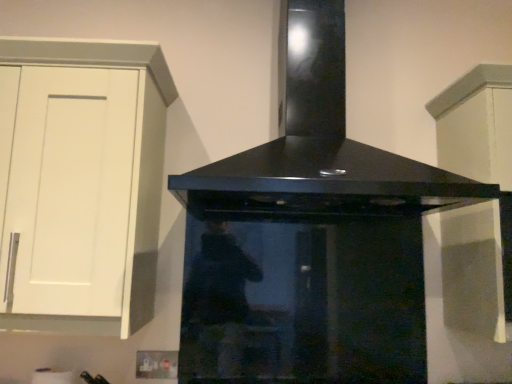
Question: From the image's perspective, is black glossy range hood at center below white matte cabinet at upper right, the 1th cabinetry viewed from the right?

Choices:
 (A) yes
 (B) no

Answer: (B)

Question: Is black glossy range hood at center positioned far away from white matte cabinet at upper right, which is counted as the second cabinetry, starting from the left?

Choices:
 (A) no
 (B) yes

Answer: (A)

Question: From a real-world perspective, is black glossy range hood at center positioned over white matte cabinet at upper right, the 1th cabinetry viewed from the right, based on gravity?

Choices:
 (A) no
 (B) yes

Answer: (B)

Question: Is white matte cabinet at upper right, the 1th cabinetry viewed from the right, completely or partially inside black glossy range hood at center?

Choices:
 (A) yes
 (B) no

Answer: (B)

Question: From a real-world perspective, is black glossy range hood at center physically below white matte cabinet at upper right, the 1th cabinetry viewed from the right?

Choices:
 (A) yes
 (B) no

Answer: (B)

Question: Is white matte cabinet at left, arranged as the first cabinetry when viewed from the left, in front of or behind white matte cabinet at upper right, which is counted as the second cabinetry, starting from the left, in the image?

Choices:
 (A) front
 (B) behind

Answer: (A)

Question: Considering the positions of white matte cabinet at left, arranged as the first cabinetry when viewed from the left, and white matte cabinet at upper right, which is counted as the second cabinetry, starting from the left, in the image, is white matte cabinet at left, arranged as the first cabinetry when viewed from the left, taller or shorter than white matte cabinet at upper right, which is counted as the second cabinetry, starting from the left,?

Choices:
 (A) tall
 (B) short

Answer: (B)

Question: From a real-world perspective, is white matte cabinet at left, arranged as the first cabinetry when viewed from the left, positioned above or below white matte cabinet at upper right, which is counted as the second cabinetry, starting from the left?

Choices:
 (A) below
 (B) above

Answer: (B)

Question: Looking at their shapes, would you say white matte cabinet at left, arranged as the first cabinetry when viewed from the left, is wider or thinner than white matte cabinet at upper right, which is counted as the second cabinetry, starting from the left?

Choices:
 (A) wide
 (B) thin

Answer: (B)

Question: Choose the correct answer: Is black glossy range hood at center inside white matte cabinet at upper right, which is counted as the second cabinetry, starting from the left, or outside it?

Choices:
 (A) outside
 (B) inside

Answer: (A)

Question: Based on their sizes in the image, would you say black glossy range hood at center is bigger or smaller than white matte cabinet at upper right, the 1th cabinetry viewed from the right?

Choices:
 (A) big
 (B) small

Answer: (A)

Question: Considering the relative positions of black glossy range hood at center and white matte cabinet at upper right, which is counted as the second cabinetry, starting from the left, in the image provided, is black glossy range hood at center to the left or to the right of white matte cabinet at upper right, which is counted as the second cabinetry, starting from the left,?

Choices:
 (A) right
 (B) left

Answer: (B)

Question: From a real-world perspective, is black glossy range hood at center positioned above or below white matte cabinet at upper right, the 1th cabinetry viewed from the right?

Choices:
 (A) above
 (B) below

Answer: (A)

Question: Considering the positions of point (361, 165) and point (136, 49), is point (361, 165) closer or farther from the camera than point (136, 49)?

Choices:
 (A) farther
 (B) closer

Answer: (A)

Question: Is black glossy range hood at center to the left or to the right of white matte cabinet at left, placed as the second cabinetry when sorted from right to left, in the image?

Choices:
 (A) left
 (B) right

Answer: (B)